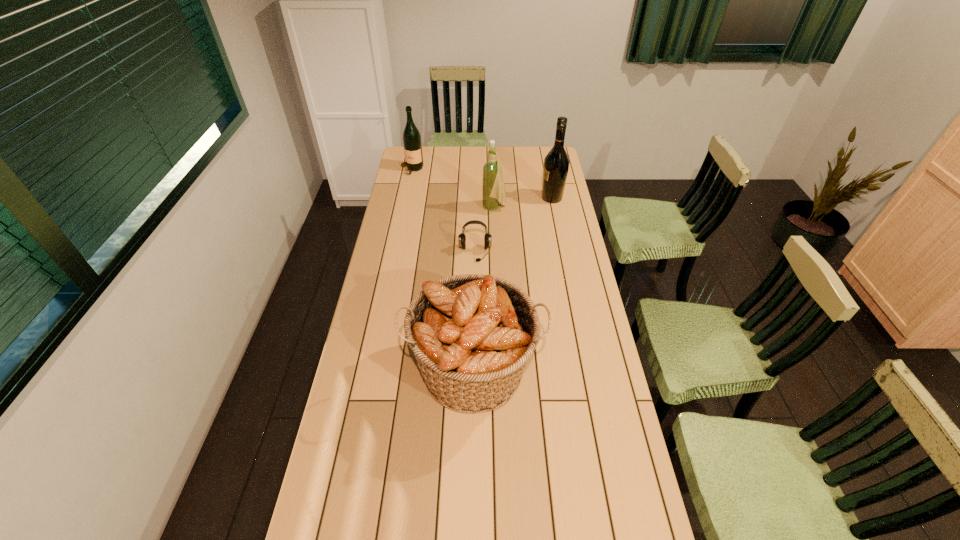
At what (x,y) coordinates should I click in order to perform the action: click on vacant space located 0.070m on the label of the tallest object. Please return your answer as a coordinate pair (x, y). Looking at the image, I should click on (525, 198).

Find the location of a particular element. Image resolution: width=960 pixels, height=540 pixels. vacant space situated 0.210m on the front-facing side of the second wine bottle from left to right is located at coordinates (437, 208).

At what (x,y) coordinates should I click in order to perform the action: click on vacant area located on the front-facing side of the second wine bottle from left to right. Please return your answer as a coordinate pair (x, y). The height and width of the screenshot is (540, 960). Looking at the image, I should click on (461, 208).

Where is `vacant space located on the front-facing side of the second wine bottle from left to right`? The image size is (960, 540). vacant space located on the front-facing side of the second wine bottle from left to right is located at coordinates (430, 208).

I want to click on free region located on the right of the farthest wine bottle, so click(443, 170).

At what (x,y) coordinates should I click in order to perform the action: click on vacant space situated 0.300m on the back of the nearest object. Please return your answer as a coordinate pair (x, y). This screenshot has width=960, height=540. Looking at the image, I should click on (475, 265).

This screenshot has width=960, height=540. Identify the location of vacant region located with the microphone on the side of the fourth farthest object. (474, 300).

At what (x,y) coordinates should I click in order to perform the action: click on object that is positioned at the far edge. Please return your answer as a coordinate pair (x, y). The width and height of the screenshot is (960, 540). Looking at the image, I should click on (412, 143).

You are a GUI agent. You are given a task and a screenshot of the screen. Output one action in this format:
    pyautogui.click(x=<x>, y=<y>)
    Task: Click on the object located in the left edge section of the desktop
    Image resolution: width=960 pixels, height=540 pixels.
    Given the screenshot: What is the action you would take?
    pyautogui.click(x=412, y=143)

Identify the location of object that is positioned at the right edge. The image size is (960, 540). (556, 163).